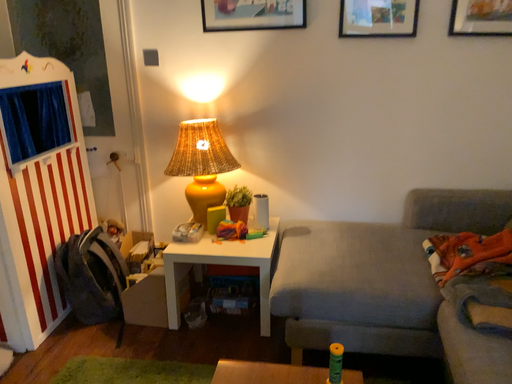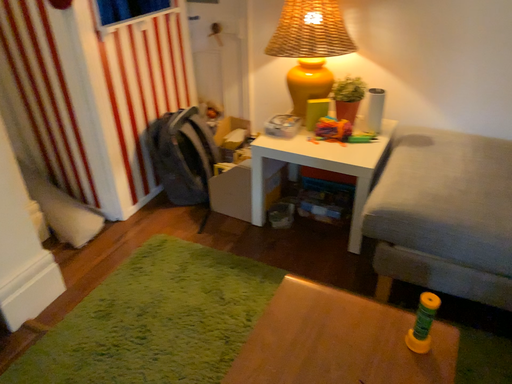
Question: Which way did the camera rotate in the video?

Choices:
 (A) rotated downward
 (B) rotated upward

Answer: (A)